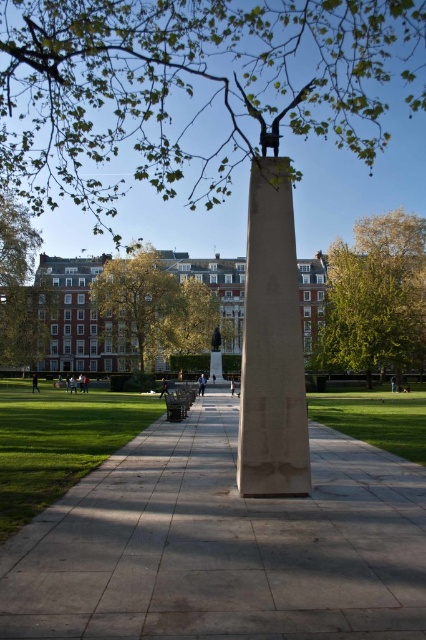
Does beige stone obelisk at center come in front of green grass at lower left?

No.

In the scene shown: Which of these two, beige stone obelisk at center or green grass at lower left, stands taller?

Standing taller between the two is beige stone obelisk at center.

At what (x,y) coordinates should I click in order to perform the action: click on beige stone obelisk at center. Please return your answer as a coordinate pair (x, y). Looking at the image, I should click on (271, 344).

Which is above, beige stone obelisk at center or green leafy tree at right?

green leafy tree at right

Is point (247, 444) positioned in front of point (328, 250)?

That is True.

Where is `beige stone obelisk at center`? beige stone obelisk at center is located at coordinates (271, 344).

Does green leafy tree at right appear on the left side of green leafy tree at left?

No, green leafy tree at right is not to the left of green leafy tree at left.

Based on the photo, who is more distant from viewer, (402,358) or (25,241)?

Point (25,241)

Find the location of a particular element. This screenshot has height=640, width=426. green leafy tree at right is located at coordinates (377, 298).